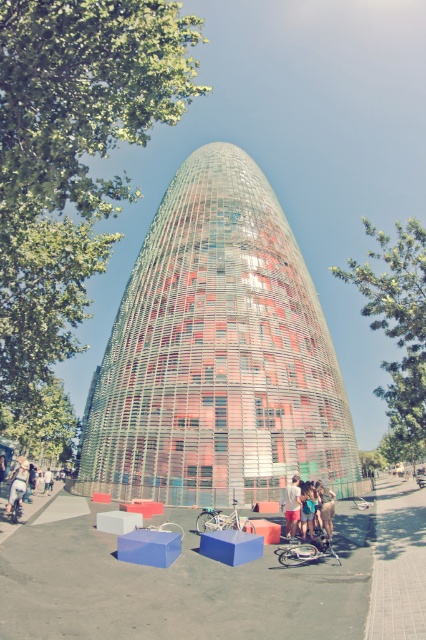
Question: Which point is closer to the camera taking this photo?

Choices:
 (A) (20, 467)
 (B) (253, 180)
 (C) (321, 490)

Answer: (C)

Question: Among these objects, which one is nearest to the camera?

Choices:
 (A) white cotton shirt at lower center
 (B) light blue denim shorts at lower left
 (C) matte pink shorts at lower center

Answer: (C)

Question: Which object is the farthest from the light blue denim shorts at lower left?

Choices:
 (A) matte pink shorts at lower center
 (B) white cotton shirt at lower center

Answer: (A)

Question: Can you confirm if white cotton shirt at lower center is positioned above light blue denim shorts at lower left?

Choices:
 (A) no
 (B) yes

Answer: (B)

Question: Does white cotton shirt at lower center appear over light blue denim shorts at lower left?

Choices:
 (A) no
 (B) yes

Answer: (B)

Question: Can you confirm if matte pink shorts at lower center is positioned below light blue denim shorts at lower left?

Choices:
 (A) yes
 (B) no

Answer: (B)